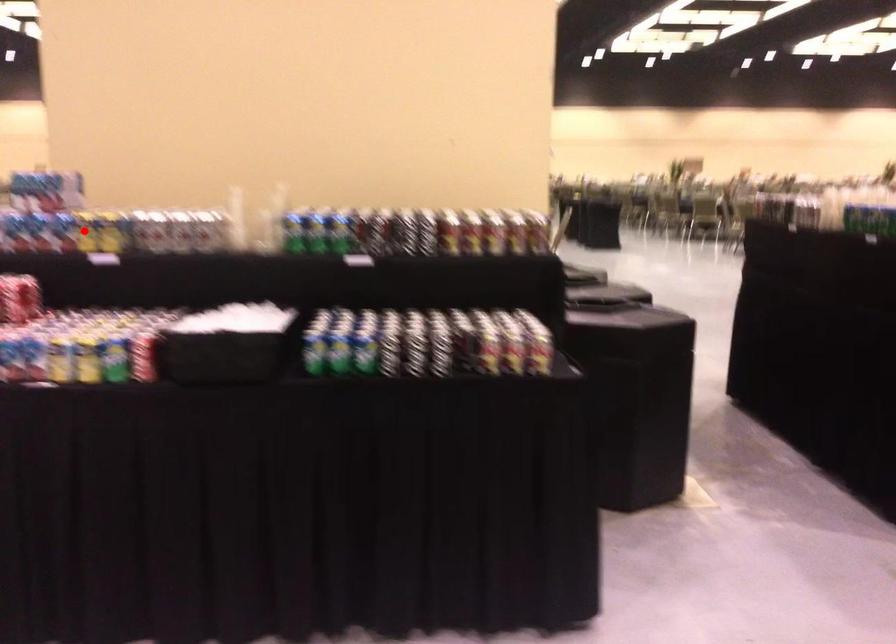
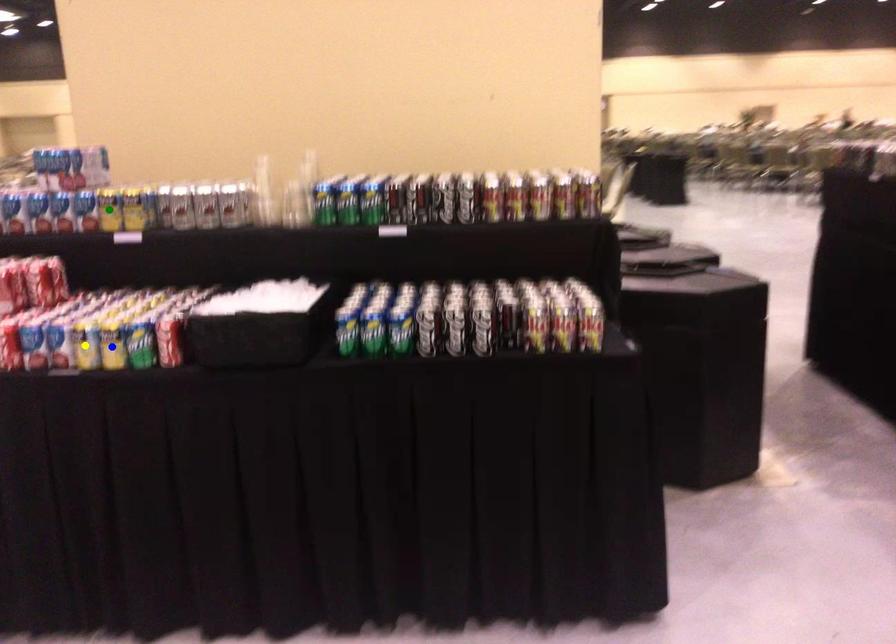
Question: I am providing you with two images of the same scene from different viewpoints. A red point is marked on the first image. You are given multiple points on the second image. Which mark in image 2 goes with the point in image 1?

Choices:
 (A) blue point
 (B) green point
 (C) yellow point

Answer: (B)